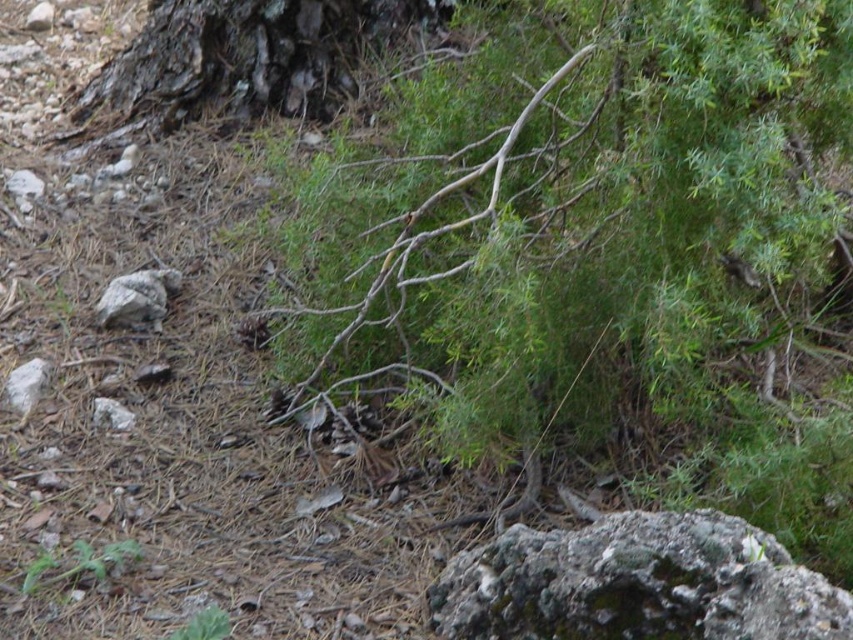
You are a hiker who just found a gray rough rock at lower right and a dark brown bark at upper left in the forest. Which object is closer to you?

The gray rough rock at lower right is closer to you because it is in front of the dark brown bark at upper left.